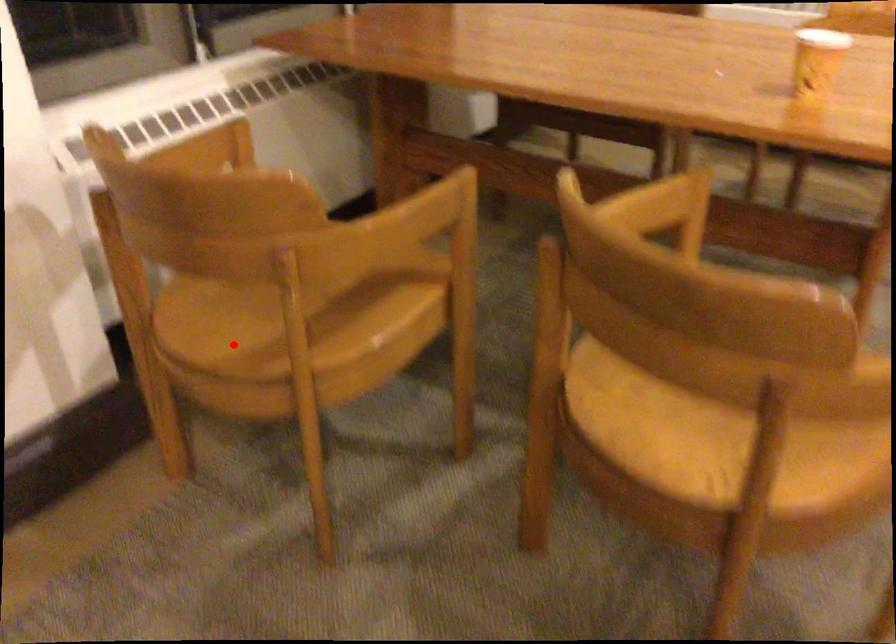
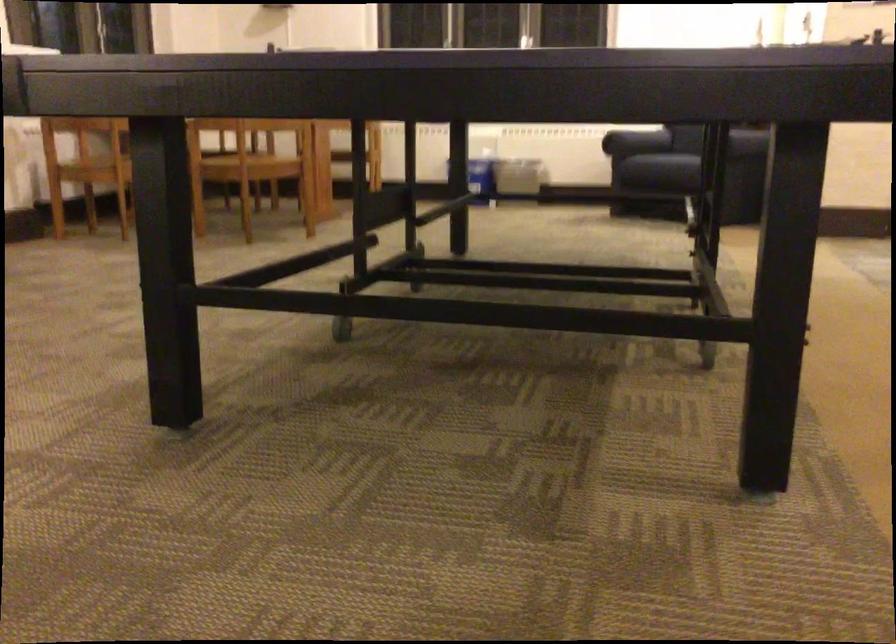
Where in the second image is the point corresponding to the highlighted location from the first image?

(95, 169)